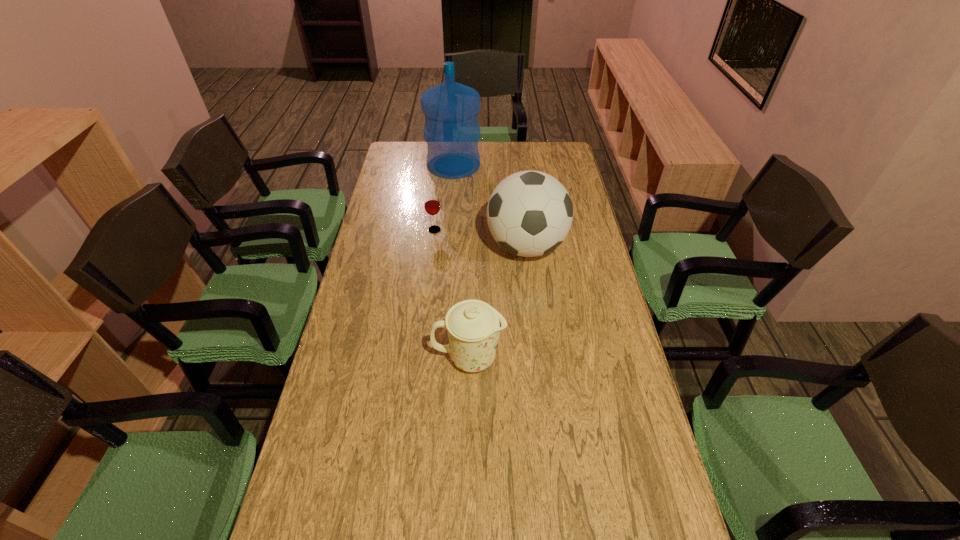
This screenshot has height=540, width=960. Find the location of `object that is positioned at the far edge`. object that is positioned at the far edge is located at coordinates (451, 131).

Image resolution: width=960 pixels, height=540 pixels. I want to click on object located in the right edge section of the desktop, so click(529, 213).

In the image, there is a desktop. In order to click on vacant space at the far edge in this screenshot , I will do click(x=508, y=161).

At what (x,y) coordinates should I click in order to perform the action: click on free space at the left edge of the desktop. Please return your answer as a coordinate pair (x, y). Looking at the image, I should click on point(380,322).

The width and height of the screenshot is (960, 540). In the image, there is a desktop. What are the coordinates of `vacant region at the right edge` in the screenshot? It's located at (569, 190).

Locate an element on the screen. Image resolution: width=960 pixels, height=540 pixels. free space at the far left corner is located at coordinates (420, 161).

I want to click on free point between the water jug and the third tallest object, so click(462, 261).

The height and width of the screenshot is (540, 960). I want to click on vacant space in between the water jug and the shortest object, so click(x=444, y=198).

This screenshot has height=540, width=960. I want to click on free space between the tallest object and the glass, so click(444, 198).

Image resolution: width=960 pixels, height=540 pixels. What are the coordinates of `vacant space that is in between the glass and the third tallest object` in the screenshot? It's located at click(452, 294).